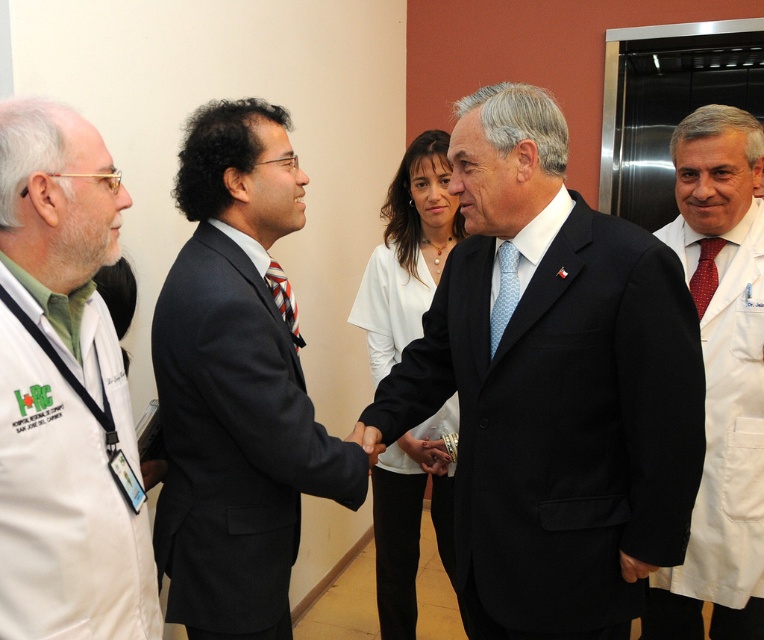
Is white lab coat at right positioned behind white fabric shirt at center?

No, white lab coat at right is in front of white fabric shirt at center.

This screenshot has width=764, height=640. I want to click on white lab coat at right, so click(x=720, y=378).

Is point (672, 234) positioned in front of point (410, 541)?

Yes, point (672, 234) is in front of point (410, 541).

Identify the location of white lab coat at right. (720, 378).

This screenshot has height=640, width=764. Find the location of `white lab coat at center`. white lab coat at center is located at coordinates (552, 387).

Measure the distance between white lab coat at center and camera.

They are 1.30 meters apart.

Image resolution: width=764 pixels, height=640 pixels. Identify the location of white lab coat at center. (552, 387).

Who is more forward, (228, 460) or (426, 464)?

Point (228, 460)

Is matte black suit at center to the right of white fabric shirt at center from the viewer's perspective?

Incorrect, matte black suit at center is not on the right side of white fabric shirt at center.

Between point (300, 420) and point (389, 545), which one is positioned behind?

Positioned behind is point (389, 545).

Locate an element on the screen. The width and height of the screenshot is (764, 640). matte black suit at center is located at coordinates (238, 385).